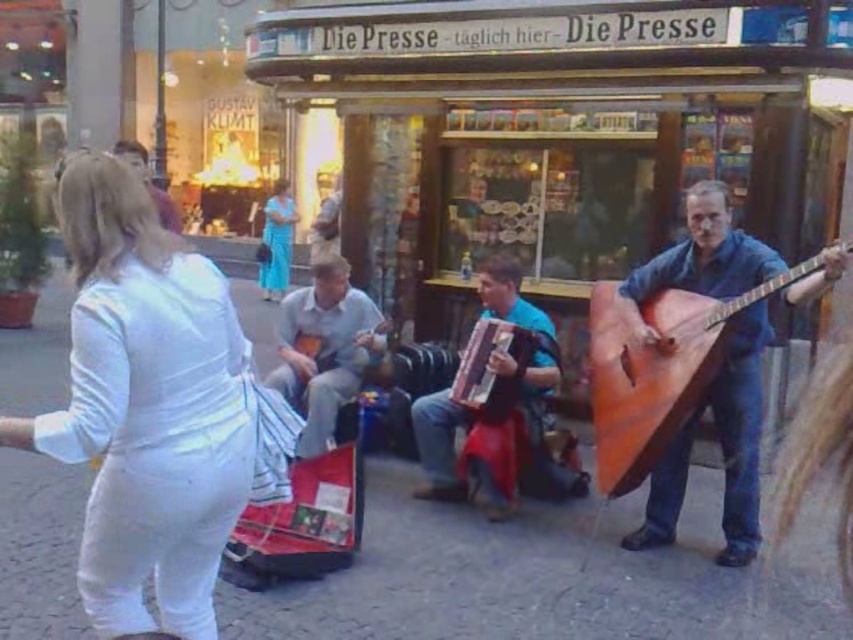
Who is more forward, (502, 337) or (148, 164)?

Point (502, 337) is more forward.

Is point (509, 396) positioned in front of point (144, 173)?

Yes, point (509, 396) is closer to viewer.

The height and width of the screenshot is (640, 853). What are the coordinates of `wooden textured accordion at center` in the screenshot? It's located at 490,371.

Find the location of a particular element. The image size is (853, 640). wooden textured accordion at center is located at coordinates (490, 371).

The image size is (853, 640). What are the coordinates of `white satin dress at left` in the screenshot? It's located at (146, 406).

From the picture: Who is more distant from viewer, (107, 218) or (505, 307)?

Point (505, 307)

Identify the location of white satin dress at left. The width and height of the screenshot is (853, 640). (146, 406).

Who is taller, white satin dress at left or blue silk dress at center?

Answer: With more height is blue silk dress at center.

You are a GUI agent. You are given a task and a screenshot of the screen. Output one action in this format:
    pyautogui.click(x=<x>, y=<y>)
    Task: Click on the white satin dress at left
    Image resolution: width=853 pixels, height=640 pixels.
    Given the screenshot: What is the action you would take?
    pyautogui.click(x=146, y=406)